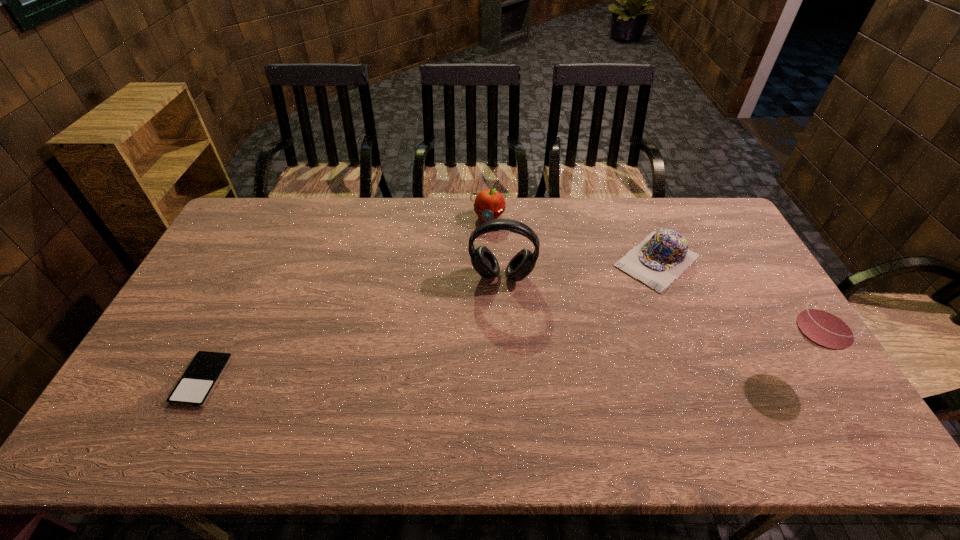
What are the coordinates of `vacant area that lies between the leftmost object and the apple` in the screenshot? It's located at (345, 299).

This screenshot has height=540, width=960. Identify the location of vacant region between the rightmost object and the third shortest object. (638, 293).

The image size is (960, 540). Identify the location of blank region between the leftmost object and the cap. (430, 320).

Select which object is the fourth closest to the shortest object. Please provide its 2D coordinates. Your answer should be formatted as a tuple, i.e. [(x, y)], where the tuple contains the x and y coordinates of a point satisfying the conditions above.

[(828, 324)]

Identify which object is the second closest to the farthest object. Please provide its 2D coordinates. Your answer should be formatted as a tuple, i.e. [(x, y)], where the tuple contains the x and y coordinates of a point satisfying the conditions above.

[(661, 258)]

Find the location of `free location that satisfies the following two spatial constraints: 1. on the back side of the third tallest object; 2. on the right side of the iPod`. free location that satisfies the following two spatial constraints: 1. on the back side of the third tallest object; 2. on the right side of the iPod is located at coordinates (283, 217).

You are a GUI agent. You are given a task and a screenshot of the screen. Output one action in this format:
    pyautogui.click(x=<x>, y=<y>)
    Task: Click on the vacant point that satisfies the following two spatial constraints: 1. on the front side of the headset; 2. on the left side of the apple
    
    Given the screenshot: What is the action you would take?
    pyautogui.click(x=489, y=276)